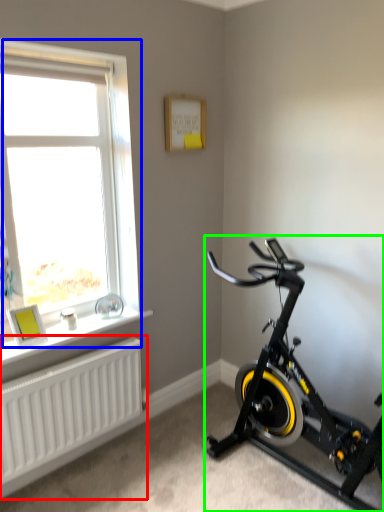
Question: Which object is positioned closest to radiator (highlighted by a red box)? Select from window (highlighted by a blue box) and stationary bicycle (highlighted by a green box).

Choices:
 (A) window
 (B) stationary bicycle

Answer: (A)